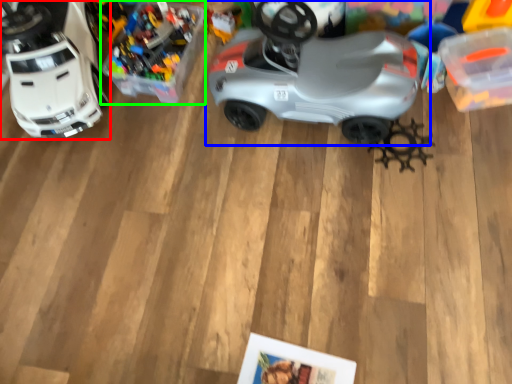
Question: Which object is the farthest from toy (highlighted by a red box)? Choose among these: car (highlighted by a blue box) or toy (highlighted by a green box).

Choices:
 (A) car
 (B) toy

Answer: (A)